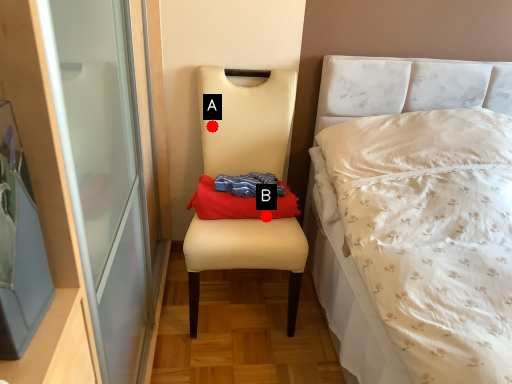
Question: Two points are circled on the image, labeled by A and B beside each circle. Which point is closer to the camera?

Choices:
 (A) A is closer
 (B) B is closer

Answer: (B)